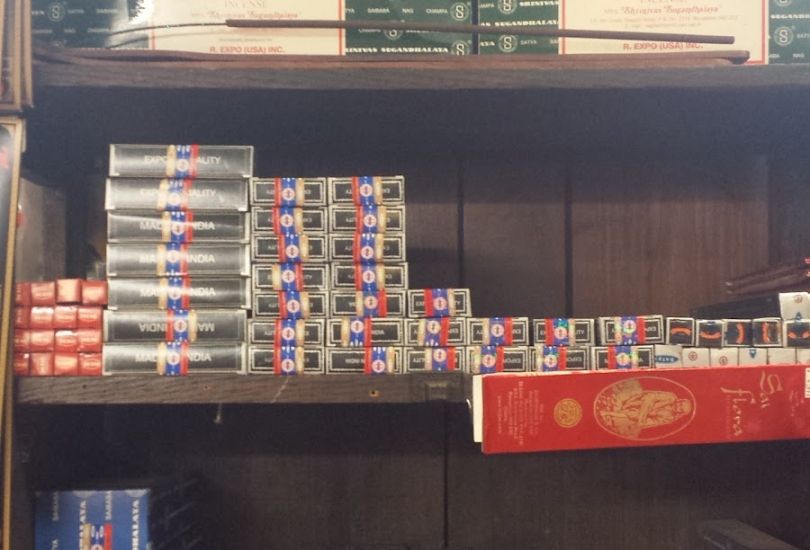
Where is `large box`? large box is located at coordinates pos(180,354), pos(205,315), pos(207,298), pos(211,255), pos(218,221), pos(216,189), pos(224,156).